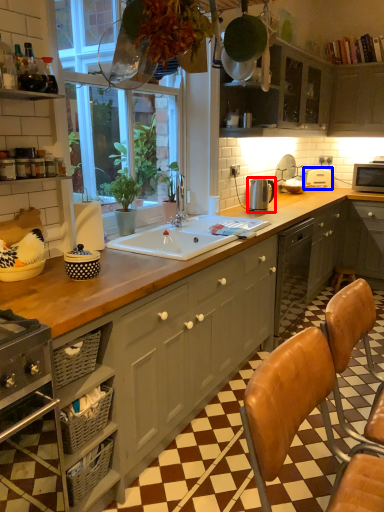
Question: Which point is further to the camera, appliance (highlighted by a red box) or appliance (highlighted by a blue box)?

Choices:
 (A) appliance
 (B) appliance

Answer: (B)